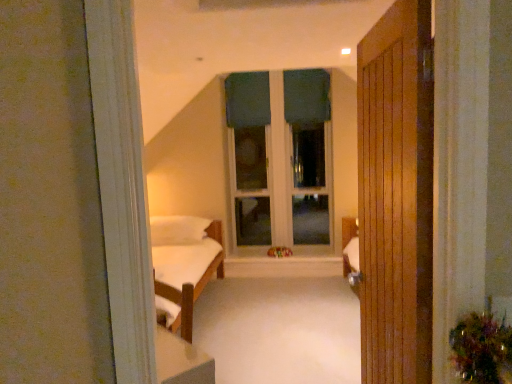
Identify the location of plush yellow teddy bear at center. The width and height of the screenshot is (512, 384). (279, 252).

Measure the distance between point (273,257) and camera.

16.93 feet.

What is the approximate width of teal fabric window at center?

teal fabric window at center is 7.65 inches wide.

What is the approximate width of white soft pillow at center?

The width of white soft pillow at center is 30.72 inches.

The height and width of the screenshot is (384, 512). I want to click on wooden door at right, so click(x=396, y=195).

From the image's perspective, is plush yellow teddy bear at center over dark green fabric curtain at upper center, which is the first curtain from right to left?

No, from the image's perspective, plush yellow teddy bear at center is not over dark green fabric curtain at upper center, which is the first curtain from right to left.

Is the depth of plush yellow teddy bear at center greater than that of dark green fabric curtain at upper center, which is the first curtain from right to left?

No, it is in front of dark green fabric curtain at upper center, which is the first curtain from right to left.

Is plush yellow teddy bear at center located outside dark green fabric curtain at upper center, which is the first curtain from right to left?

plush yellow teddy bear at center lies outside dark green fabric curtain at upper center, which is the first curtain from right to left,'s area.

Considering the positions of point (284, 248) and point (293, 70), is point (284, 248) closer or farther from the camera than point (293, 70)?

Point (284, 248) appears to be closer to the viewer than point (293, 70).

Which object is further away from the camera, dark green fabric curtain at upper center, which is the second curtain in left-to-right order, or teal fabric window at center?

dark green fabric curtain at upper center, which is the second curtain in left-to-right order, is behind.

Is dark green fabric curtain at upper center, which is the first curtain from right to left, smaller than teal fabric window at center?

Yes.

Is dark green fabric curtain at upper center, which is the second curtain in left-to-right order, far away from teal fabric window at center?

They are positioned close to each other.

Which of these two, dark green fabric curtain at upper center, which is the first curtain from right to left, or teal fabric window at center, is wider?

teal fabric window at center.

Looking at this image, who is shorter, white soft pillow at center or green fabric curtain at center, which appears as the first curtain when viewed from the left?

white soft pillow at center is shorter.

Identify the location of pillow that is below the green fabric curtain at center, which appears as the first curtain when viewed from the left (from the image's perspective). (178, 229).

Is white soft pillow at center far from green fabric curtain at center, which appears as the first curtain when viewed from the left?

Absolutely, white soft pillow at center is distant from green fabric curtain at center, which appears as the first curtain when viewed from the left.

Does white soft pillow at center appear on the right side of green fabric curtain at center, which is the second curtain in right-to-left order?

In fact, white soft pillow at center is to the left of green fabric curtain at center, which is the second curtain in right-to-left order.

From a real-world perspective, does teal fabric window at center stand above wooden door at right?

Yes, from a real-world perspective, teal fabric window at center is over wooden door at right

Is point (241, 162) closer to viewer compared to point (425, 60)?

That is False.

Is teal fabric window at center inside or outside of wooden door at right?

teal fabric window at center exists outside the volume of wooden door at right.

From the image's perspective, which one is positioned lower, teal fabric window at center or wooden door at right?

wooden door at right is shown below in the image.

Is green fabric curtain at center, which is the second curtain in right-to-left order, oriented away from white soft pillow at center?

No, white soft pillow at center is not at the back of green fabric curtain at center, which is the second curtain in right-to-left order.

Considering the relative sizes of green fabric curtain at center, which is the second curtain in right-to-left order, and white soft pillow at center in the image provided, is green fabric curtain at center, which is the second curtain in right-to-left order, shorter than white soft pillow at center?

No.

From a real-world perspective, does green fabric curtain at center, which is the second curtain in right-to-left order, stand above white soft pillow at center?

Yes, from a real-world perspective, green fabric curtain at center, which is the second curtain in right-to-left order, is above white soft pillow at center.

Is point (248, 83) closer to viewer compared to point (188, 218)?

No.

Can you confirm if dark green fabric curtain at upper center, which is the second curtain in left-to-right order, is thinner than green fabric curtain at center, which is the second curtain in right-to-left order?

Incorrect, the width of dark green fabric curtain at upper center, which is the second curtain in left-to-right order, is not less than that of green fabric curtain at center, which is the second curtain in right-to-left order.

Is point (286, 77) farther from camera compared to point (234, 120)?

That is False.

Can we say dark green fabric curtain at upper center, which is the first curtain from right to left, lies outside green fabric curtain at center, which appears as the first curtain when viewed from the left?

That's correct, dark green fabric curtain at upper center, which is the first curtain from right to left, is outside of green fabric curtain at center, which appears as the first curtain when viewed from the left.

Identify the location of curtain below the dark green fabric curtain at upper center, which is the first curtain from right to left (from a real-world perspective). (247, 99).

Is white soft pillow at center surrounded by teal fabric window at center?

No, white soft pillow at center is not a part of teal fabric window at center.

Between point (245, 156) and point (155, 240), which one is positioned behind?

The point (245, 156) is farther.

From a real-world perspective, who is located higher, teal fabric window at center or white soft pillow at center?

teal fabric window at center.

You are a GUI agent. You are given a task and a screenshot of the screen. Output one action in this format:
    pyautogui.click(x=<x>, y=<y>)
    Task: Click on the pillow on the left of teal fabric window at center
    This screenshot has width=512, height=384.
    Given the screenshot: What is the action you would take?
    pyautogui.click(x=178, y=229)

Find the location of a particular element. The height and width of the screenshot is (384, 512). toy below the dark green fabric curtain at upper center, which is the first curtain from right to left (from a real-world perspective) is located at coordinates (279, 252).

There is a teal fabric window at center. Identify the location of the 2nd curtain above it (from the image's perspective). This screenshot has width=512, height=384. (306, 96).

Looking at the image, which one is located closer to dark green fabric curtain at upper center, which is the second curtain in left-to-right order, plush yellow teddy bear at center or teal fabric window at center?

Among the two, teal fabric window at center is located nearer to dark green fabric curtain at upper center, which is the second curtain in left-to-right order.

Estimate the real-world distances between objects in this image. Which object is closer to plush yellow teddy bear at center, white soft pillow at center or dark green fabric curtain at upper center, which is the first curtain from right to left?

Among the two, white soft pillow at center is located nearer to plush yellow teddy bear at center.

From the image, which object appears to be nearer to white soft pillow at center, wooden door at right or green fabric curtain at center, which appears as the first curtain when viewed from the left?

green fabric curtain at center, which appears as the first curtain when viewed from the left.

From the image, which object appears to be nearer to dark green fabric curtain at upper center, which is the first curtain from right to left, wooden door at right or teal fabric window at center?

Based on the image, teal fabric window at center appears to be nearer to dark green fabric curtain at upper center, which is the first curtain from right to left.

Based on their spatial positions, is teal fabric window at center or wooden door at right further from white soft pillow at center?

The object further to white soft pillow at center is wooden door at right.

Estimate the real-world distances between objects in this image. Which object is closer to wooden door at right, plush yellow teddy bear at center or white soft pillow at center?

white soft pillow at center.

Considering their positions, is dark green fabric curtain at upper center, which is the second curtain in left-to-right order, positioned closer to wooden door at right than teal fabric window at center?

teal fabric window at center is closer to wooden door at right.

When comparing their distances from plush yellow teddy bear at center, does white soft pillow at center or wooden door at right seem further?

wooden door at right.

Locate an element on the screen. The height and width of the screenshot is (384, 512). bay window between dark green fabric curtain at upper center, which is the first curtain from right to left, and white soft pillow at center from top to bottom is located at coordinates [280, 156].

What are the coordinates of `pillow between wooden door at right and plush yellow teddy bear at center in the front-back direction` in the screenshot? It's located at (178, 229).

The height and width of the screenshot is (384, 512). In order to click on pillow that lies between green fabric curtain at center, which appears as the first curtain when viewed from the left, and plush yellow teddy bear at center from top to bottom in this screenshot , I will do `click(178, 229)`.

Image resolution: width=512 pixels, height=384 pixels. What are the coordinates of `bay window between wooden door at right and dark green fabric curtain at upper center, which is the second curtain in left-to-right order, along the z-axis` in the screenshot? It's located at (280, 156).